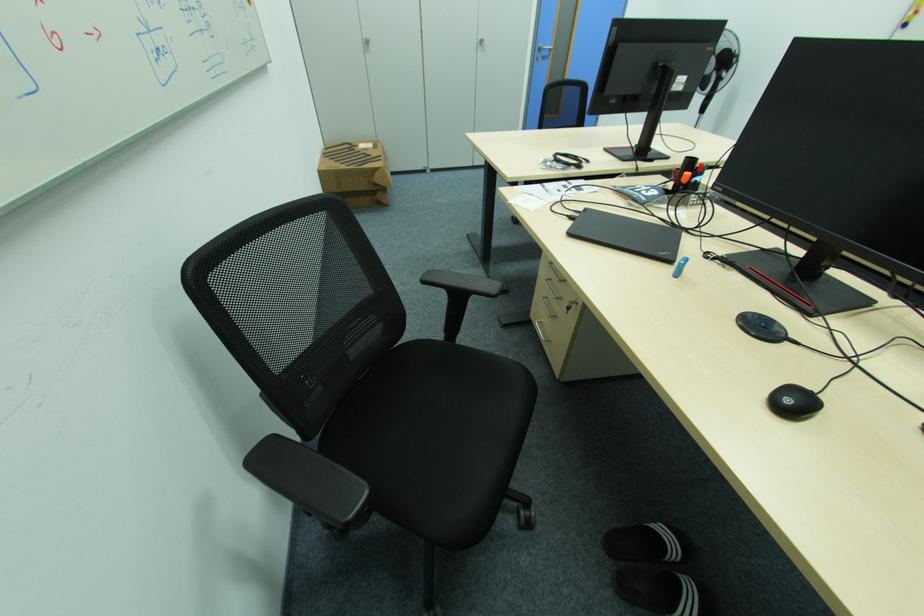
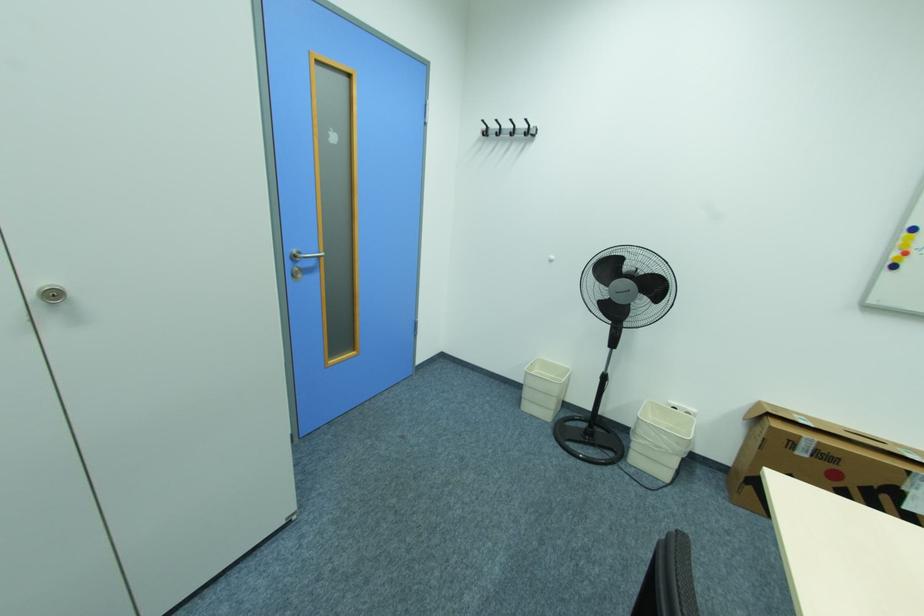
Find the pixel in the second image that matches point 487,43 in the first image.

(64, 294)